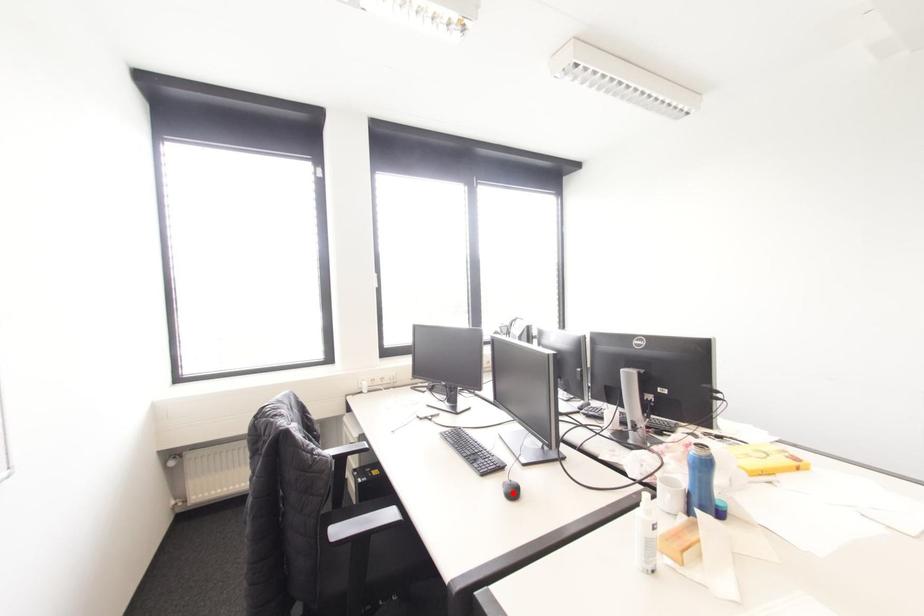
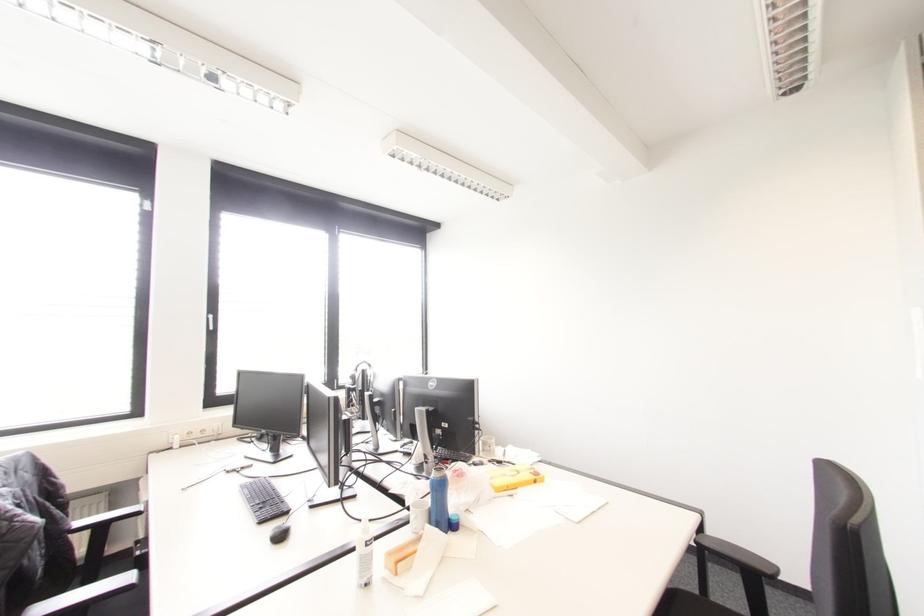
Find the pixel in the second image that matches the highlighted location in the first image.

(281, 536)